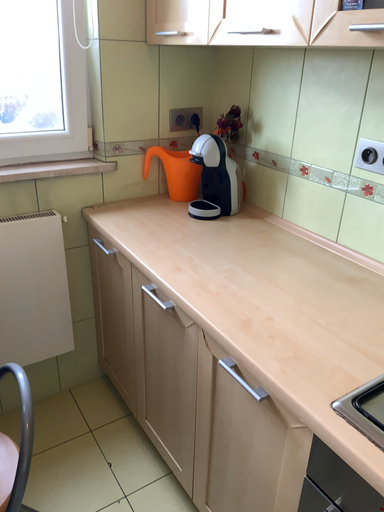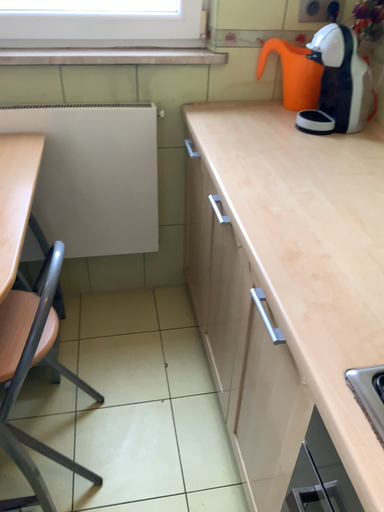
Question: How did the camera likely rotate when shooting the video?

Choices:
 (A) rotated left
 (B) rotated right

Answer: (A)